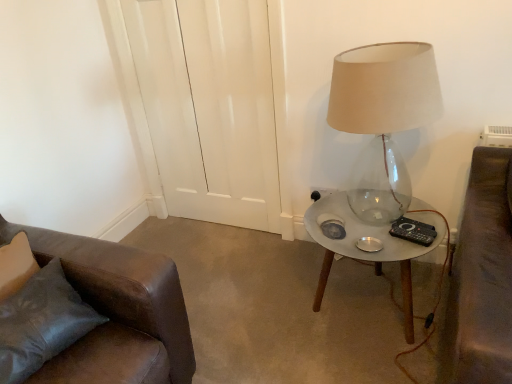
Locate an element on the screen. vacant space in front of black plastic remote control at right is located at coordinates (417, 244).